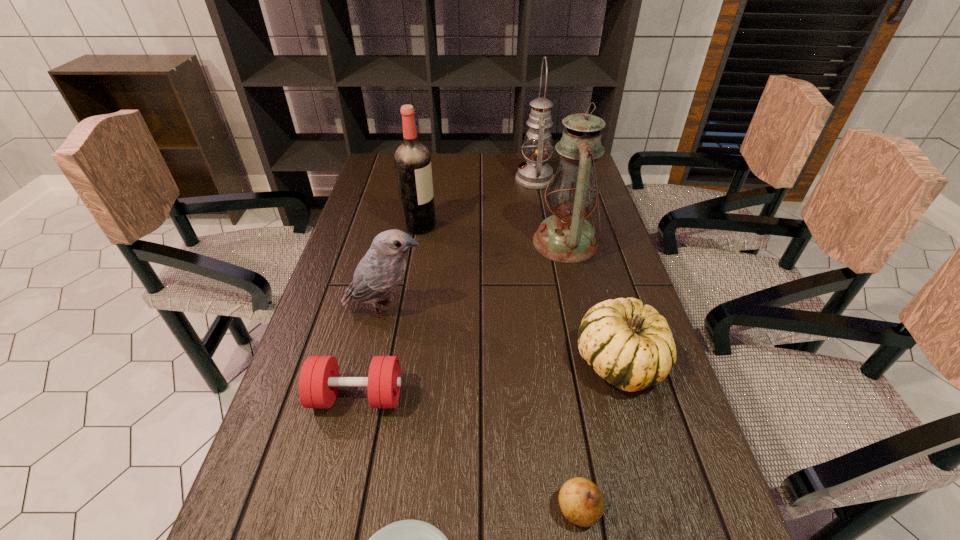
Where is `vacant point located on the front-facing side of the liquor`? The width and height of the screenshot is (960, 540). vacant point located on the front-facing side of the liquor is located at coordinates (468, 226).

Where is `free space located on the front-facing side of the parrot`? free space located on the front-facing side of the parrot is located at coordinates (491, 309).

This screenshot has width=960, height=540. I want to click on free space located on the back of the fourth shortest object, so click(598, 291).

Find the location of a particular element. The height and width of the screenshot is (540, 960). vacant region located on the right of the dumbbell is located at coordinates (584, 396).

Find the location of a particular element. Image resolution: width=960 pixels, height=540 pixels. free region located 0.400m on the left of the pear is located at coordinates (325, 509).

Locate an element on the screen. The image size is (960, 540). object present at the far edge is located at coordinates tap(534, 174).

The height and width of the screenshot is (540, 960). I want to click on parrot situated at the left edge, so click(378, 273).

Identify the location of dumbbell at the left edge. The height and width of the screenshot is (540, 960). (319, 380).

Identify the location of gourd present at the right edge. (630, 345).

The image size is (960, 540). In order to click on object situated at the far right corner in this screenshot , I will do `click(534, 174)`.